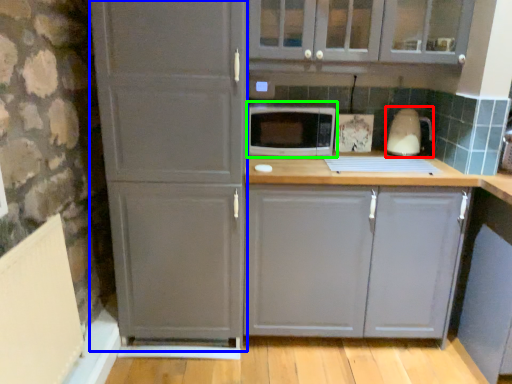
Question: Which object is the closest to the appliance (highlighted by a red box)? Choose among these: screen door (highlighted by a blue box) or microwave oven (highlighted by a green box).

Choices:
 (A) screen door
 (B) microwave oven

Answer: (B)